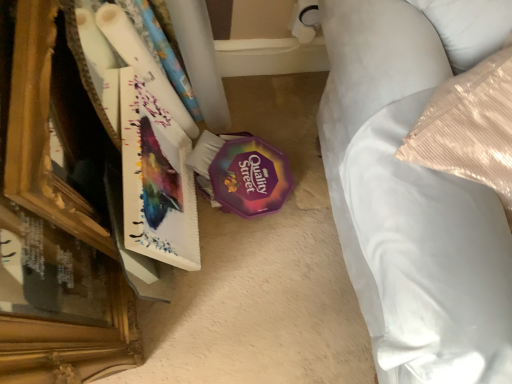
Question: Is white satin bed at right closer to camera compared to matte paperboard book at left?

Choices:
 (A) yes
 (B) no

Answer: (A)

Question: Is white satin bed at right wider than matte paperboard book at left?

Choices:
 (A) yes
 (B) no

Answer: (A)

Question: From the image's perspective, is white satin bed at right below matte paperboard book at left?

Choices:
 (A) no
 (B) yes

Answer: (A)

Question: Is white satin bed at right directly adjacent to matte paperboard book at left?

Choices:
 (A) yes
 (B) no

Answer: (B)

Question: Considering the relative sizes of white satin bed at right and matte paperboard book at left in the image provided, is white satin bed at right shorter than matte paperboard book at left?

Choices:
 (A) yes
 (B) no

Answer: (B)

Question: Is white satin bed at right thinner than matte paperboard book at left?

Choices:
 (A) no
 (B) yes

Answer: (A)

Question: Is matte paperboard book at left touching white satin bed at right?

Choices:
 (A) no
 (B) yes

Answer: (A)

Question: Is matte paperboard book at left located outside white satin bed at right?

Choices:
 (A) yes
 (B) no

Answer: (A)

Question: Is matte paperboard book at left oriented towards white satin bed at right?

Choices:
 (A) yes
 (B) no

Answer: (A)

Question: Is matte paperboard book at left wider than white satin bed at right?

Choices:
 (A) yes
 (B) no

Answer: (B)

Question: Considering the relative sizes of matte paperboard book at left and white satin bed at right in the image provided, is matte paperboard book at left shorter than white satin bed at right?

Choices:
 (A) yes
 (B) no

Answer: (A)

Question: Is matte paperboard book at left positioned in front of white satin bed at right?

Choices:
 (A) yes
 (B) no

Answer: (B)

Question: Considering their positions, is white satin bed at right located in front of or behind matte paperboard book at left?

Choices:
 (A) front
 (B) behind

Answer: (A)